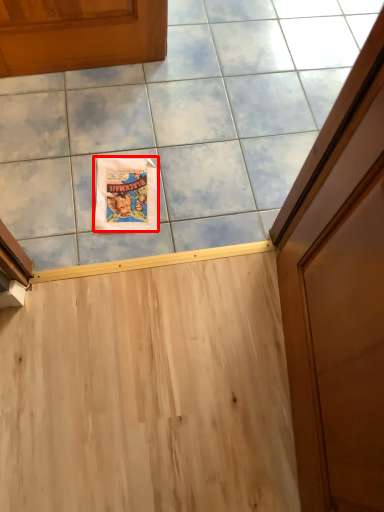
Question: Where is comic book (annotated by the red box) located in relation to ceramic tile in the image?

Choices:
 (A) right
 (B) left

Answer: (B)